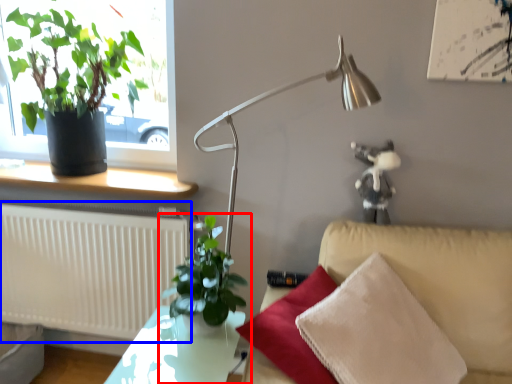
Question: Which object appears closest to the camera in this image, houseplant (highlighted by a red box) or radiator (highlighted by a blue box)?

Choices:
 (A) houseplant
 (B) radiator

Answer: (A)